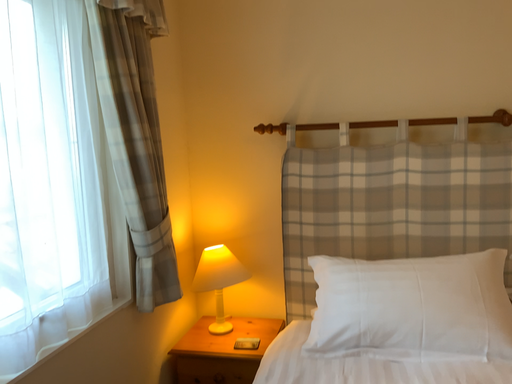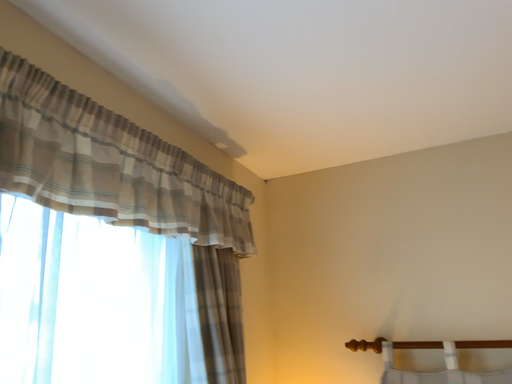
Question: How did the camera likely rotate when shooting the video?

Choices:
 (A) rotated left
 (B) rotated right

Answer: (A)